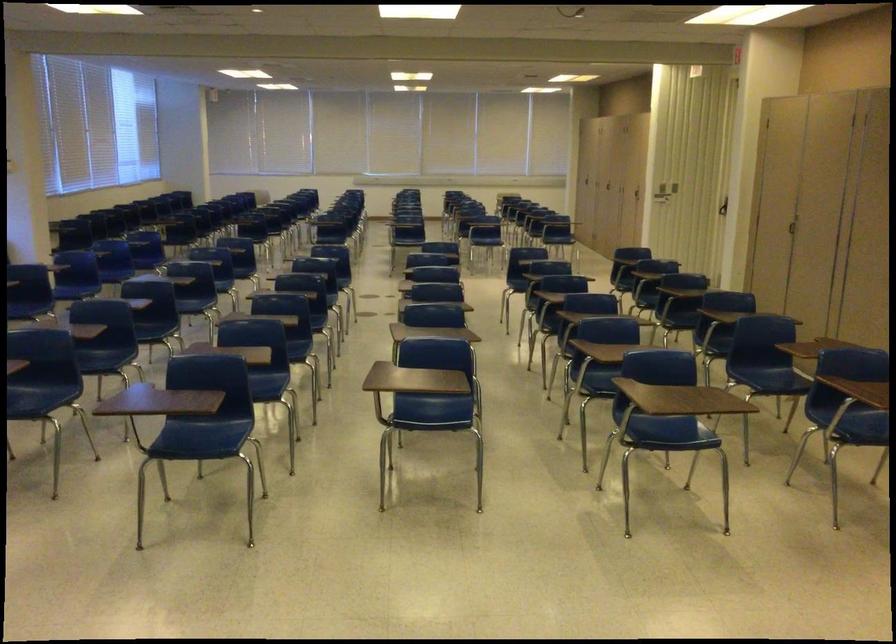
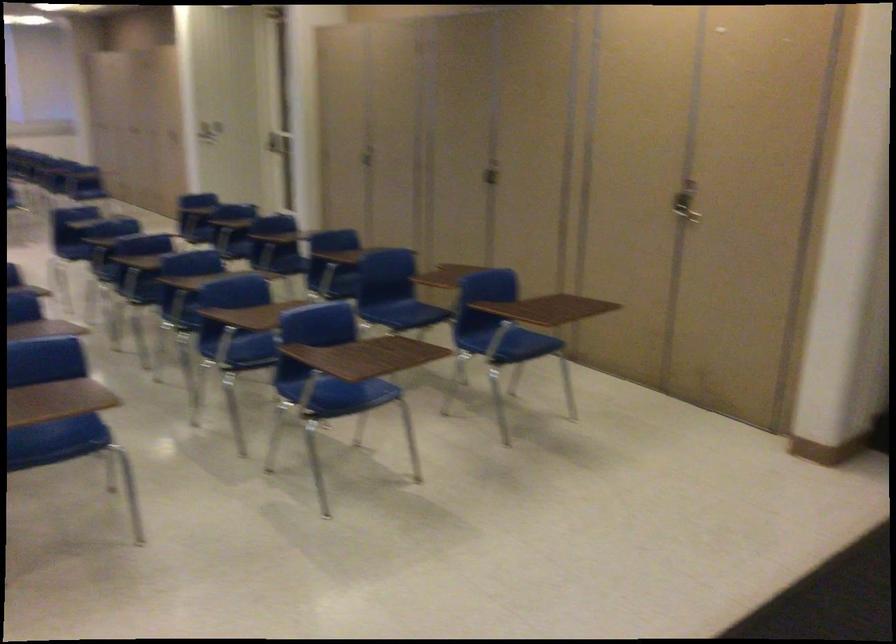
Question: The camera is either moving clockwise (left) or counter-clockwise (right) around the object. The first image is from the beginning of the video and the second image is from the end. Is the camera moving left or right when shooting the video?

Choices:
 (A) Left
 (B) Right

Answer: (A)